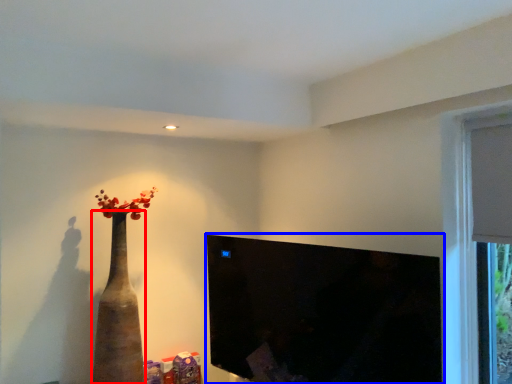
Question: Among these objects, which one is farthest to the camera, vase (highlighted by a red box) or window screen (highlighted by a blue box)?

Choices:
 (A) vase
 (B) window screen

Answer: (A)